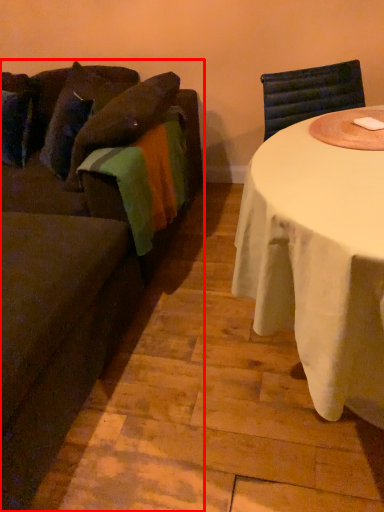
Question: From the image's perspective, what is the correct spatial positioning of studio couch (annotated by the red box) in reference to pillow?

Choices:
 (A) above
 (B) below

Answer: (B)